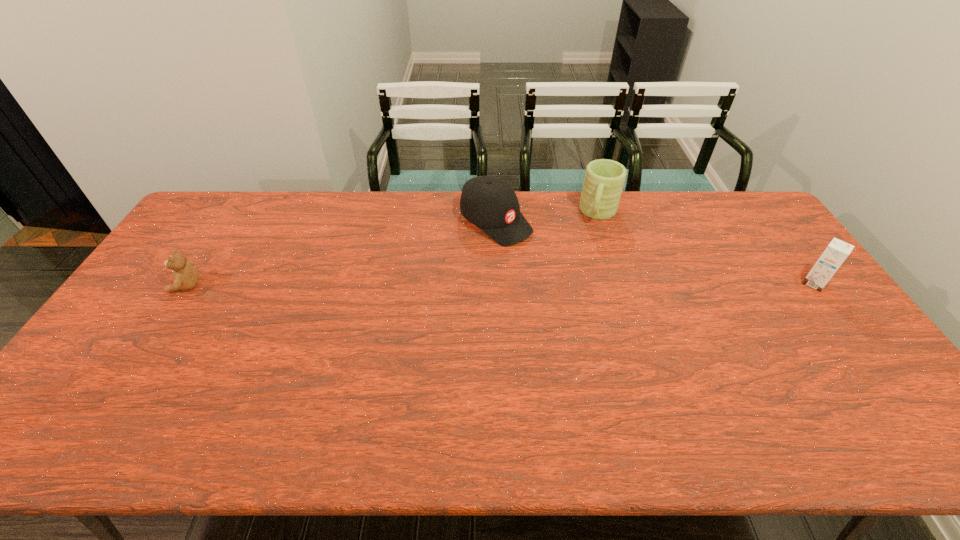
Locate an element on the screen. The image size is (960, 540). free space located 0.320m on the side of the third object from left to right with the handle is located at coordinates (575, 292).

Identify the location of vacant space situated 0.130m on the side of the third object from left to right with the handle. (588, 252).

I want to click on baseball cap located in the far edge section of the desktop, so click(x=491, y=204).

I want to click on mug positioned at the far edge, so click(x=604, y=179).

Identify the location of object present at the left edge. coord(185,275).

Identify the location of object located at the right edge. (837, 251).

What are the coordinates of `vacant area at the far edge of the desktop` in the screenshot? It's located at (406, 206).

This screenshot has width=960, height=540. Find the location of `free location at the near edge`. free location at the near edge is located at coordinates (194, 387).

In the image, there is a desktop. Identify the location of vacant space at the left edge. (115, 327).

Locate an element on the screen. free space at the right edge is located at coordinates (832, 314).